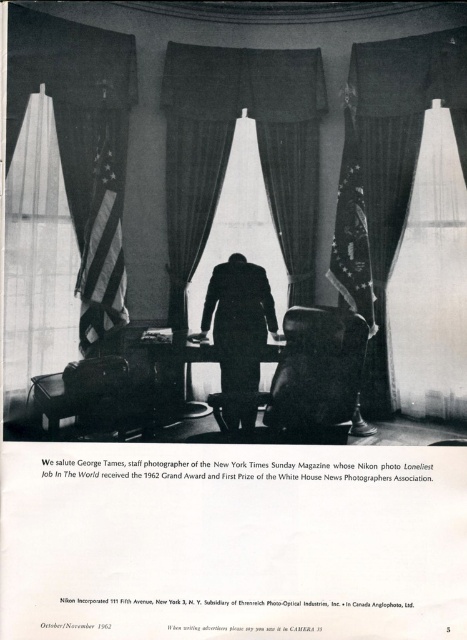
Question: Does black velvet curtains at center lie behind black suit at center?

Choices:
 (A) no
 (B) yes

Answer: (A)

Question: Is silky white curtain at center to the right of black suit at center from the viewer's perspective?

Choices:
 (A) no
 (B) yes

Answer: (A)

Question: Among these points, which one is farthest from the camera?

Choices:
 (A) (94, 150)
 (B) (171, 352)
 (C) (249, 406)

Answer: (B)

Question: Which object appears farthest from the camera in this image?

Choices:
 (A) black suit at center
 (B) silky white curtain at center
 (C) wooden chair at center

Answer: (A)

Question: Which of these objects is positioned farthest from the wooden chair at center?

Choices:
 (A) silky white curtain at center
 (B) smooth wooden table at center
 (C) translucent fabric curtain at left
 (D) black suit at center

Answer: (C)

Question: In this image, where is black velvet curtains at center located relative to silky white curtain at center?

Choices:
 (A) left
 (B) right

Answer: (B)